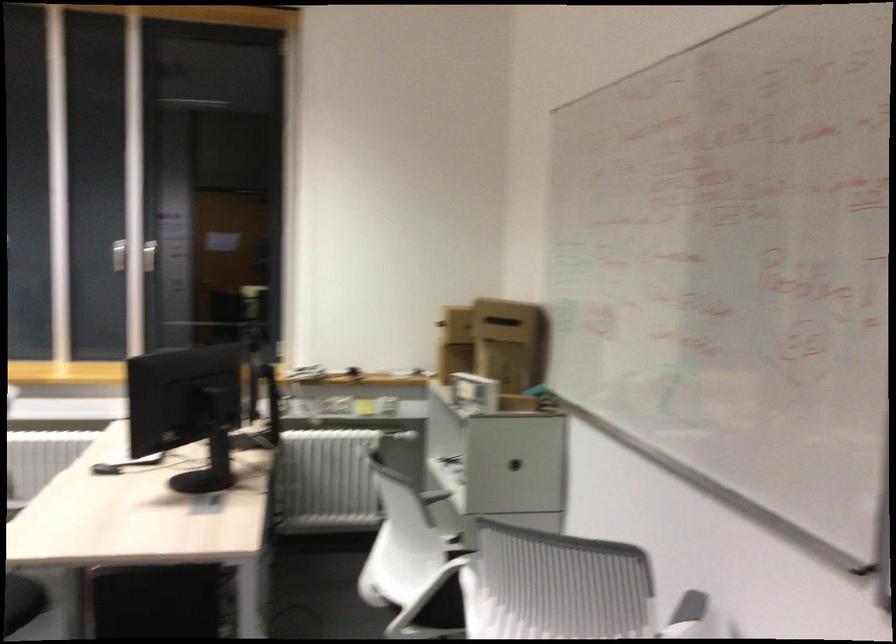
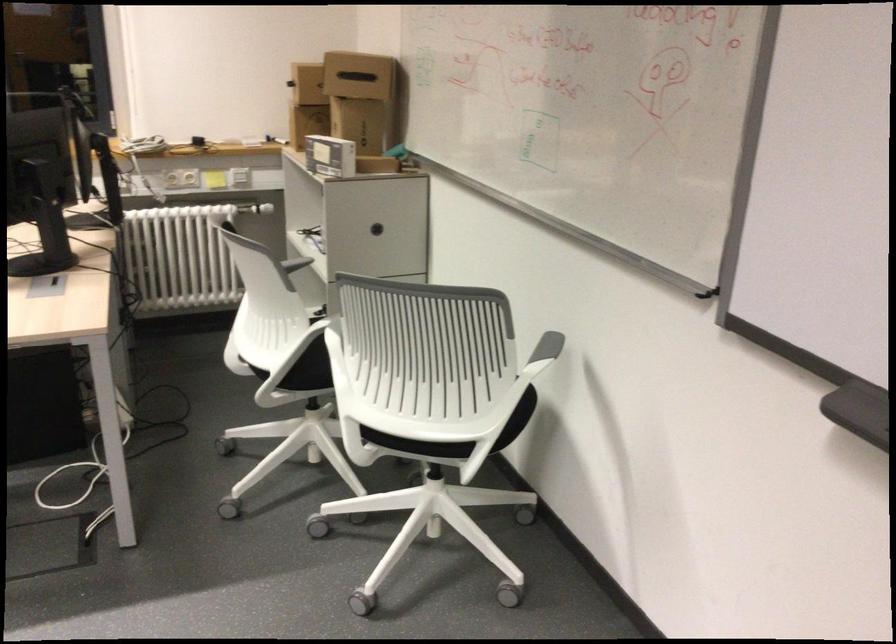
In the second image, find the point that corresponds to [466,384] in the first image.

(330, 156)